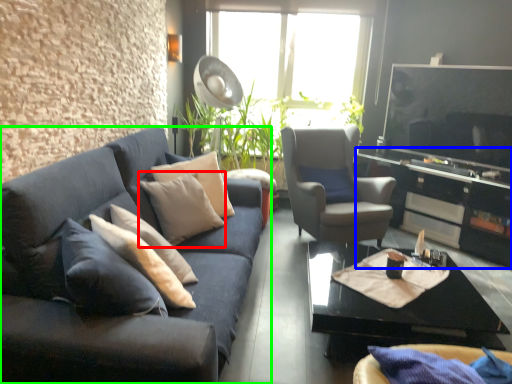
Question: Which object is the closest to the pillow (highlighted by a red box)? Choose among these: entertainment center (highlighted by a blue box) or studio couch (highlighted by a green box).

Choices:
 (A) entertainment center
 (B) studio couch

Answer: (B)